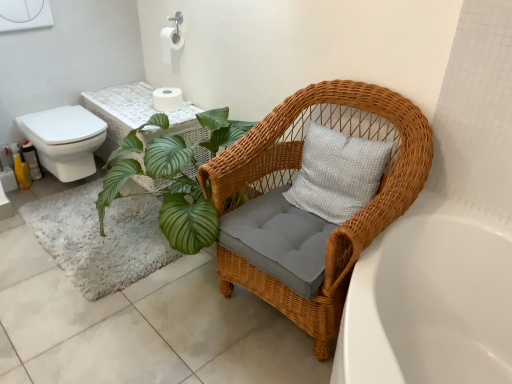
Question: Is the depth of white matte toilet paper at upper center, which is the second toilet paper in top-to-bottom order, less than that of white glossy toilet at left?

Choices:
 (A) yes
 (B) no

Answer: (B)

Question: From the image's perspective, does white matte toilet paper at upper center, which is the second toilet paper in top-to-bottom order, appear higher than white glossy toilet at left?

Choices:
 (A) no
 (B) yes

Answer: (B)

Question: From a real-world perspective, is white matte toilet paper at upper center, the 1th toilet paper positioned from the bottom, located higher than white glossy toilet at left?

Choices:
 (A) yes
 (B) no

Answer: (A)

Question: Is white glossy toilet at left completely or partially inside white matte toilet paper at upper center, which is the second toilet paper in top-to-bottom order?

Choices:
 (A) no
 (B) yes

Answer: (A)

Question: Is white matte toilet paper at upper center, the 1th toilet paper positioned from the bottom, outside white glossy toilet at left?

Choices:
 (A) yes
 (B) no

Answer: (A)

Question: From a real-world perspective, is white glossy toilet at left above or below woven wicker chair at lower right?

Choices:
 (A) below
 (B) above

Answer: (A)

Question: In terms of width, does white glossy toilet at left look wider or thinner when compared to woven wicker chair at lower right?

Choices:
 (A) wide
 (B) thin

Answer: (B)

Question: From their relative heights in the image, would you say white glossy toilet at left is taller or shorter than woven wicker chair at lower right?

Choices:
 (A) tall
 (B) short

Answer: (B)

Question: Is white glossy toilet at left to the left or to the right of woven wicker chair at lower right in the image?

Choices:
 (A) right
 (B) left

Answer: (B)

Question: Based on their sizes in the image, would you say white matte toilet paper at upper center, the 1th toilet paper positioned from the bottom, is bigger or smaller than white matte toilet paper at upper center, positioned as the 2th toilet paper in bottom-to-top order?

Choices:
 (A) big
 (B) small

Answer: (A)

Question: In the image, is white matte toilet paper at upper center, which is the second toilet paper in top-to-bottom order, on the left side or the right side of white matte toilet paper at upper center, which is the 1th toilet paper in top-to-bottom order?

Choices:
 (A) right
 (B) left

Answer: (B)

Question: Relative to white matte toilet paper at upper center, which is the 1th toilet paper in top-to-bottom order, is white matte toilet paper at upper center, which is the second toilet paper in top-to-bottom order, in front or behind?

Choices:
 (A) behind
 (B) front

Answer: (A)

Question: From their relative heights in the image, would you say white matte toilet paper at upper center, which is the second toilet paper in top-to-bottom order, is taller or shorter than white matte toilet paper at upper center, which is the 1th toilet paper in top-to-bottom order?

Choices:
 (A) short
 (B) tall

Answer: (A)

Question: Considering the positions of point (342, 127) and point (167, 61), is point (342, 127) closer or farther from the camera than point (167, 61)?

Choices:
 (A) farther
 (B) closer

Answer: (B)

Question: Relative to white matte toilet paper at upper center, positioned as the 2th toilet paper in bottom-to-top order, is woven wicker chair at lower right in front or behind?

Choices:
 (A) behind
 (B) front

Answer: (B)